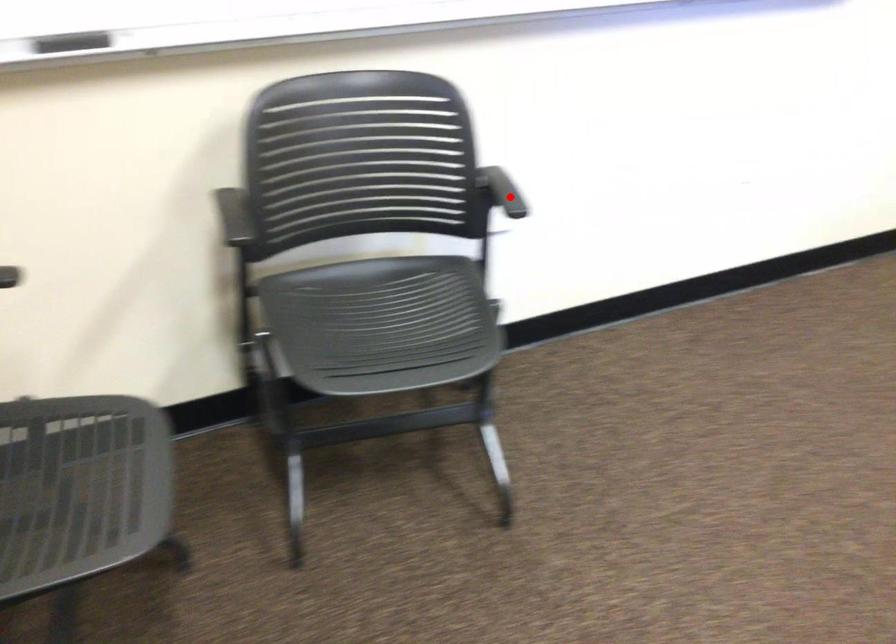
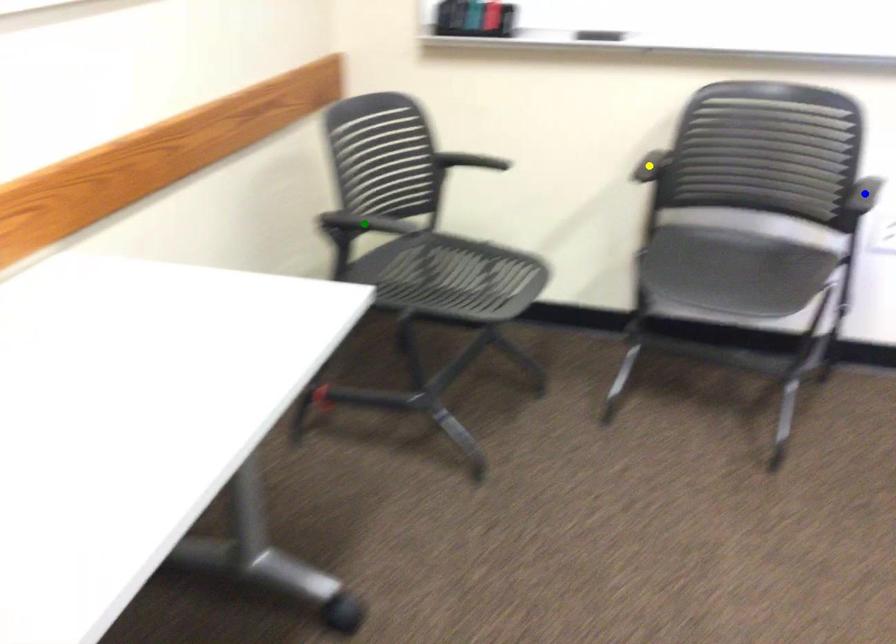
Question: I am providing you with two images of the same scene from different viewpoints. A red point is marked on the first image. You are given multiple points on the second image. In image 2, which mark is for the same physical point as the one in image 1?

Choices:
 (A) green point
 (B) blue point
 (C) yellow point

Answer: (B)